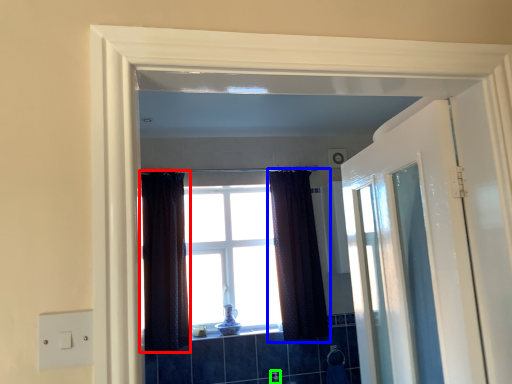
Question: Which is nearer to the curtain (highlighted by a red box)? curtain (highlighted by a blue box) or faucet (highlighted by a green box).

Choices:
 (A) curtain
 (B) faucet

Answer: (A)